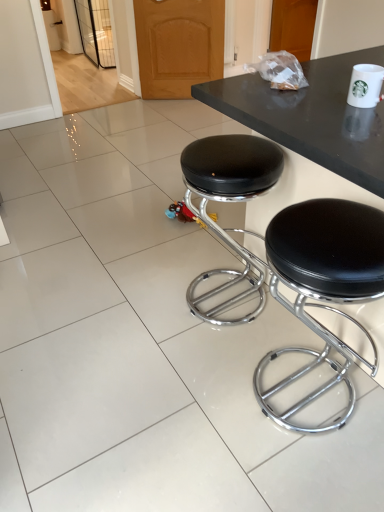
The height and width of the screenshot is (512, 384). In order to click on free space to the left of white ceramic mug at upper right in this screenshot , I will do `click(318, 109)`.